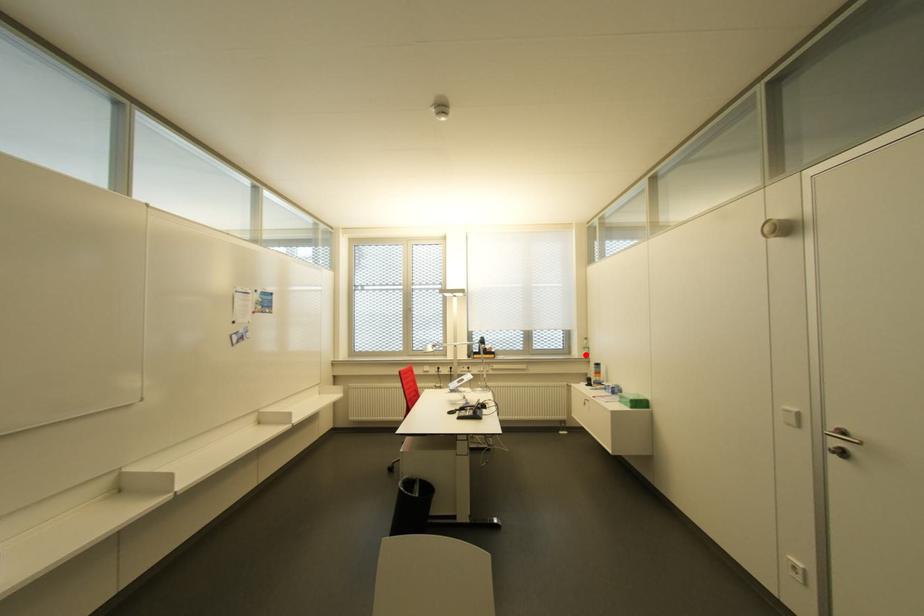
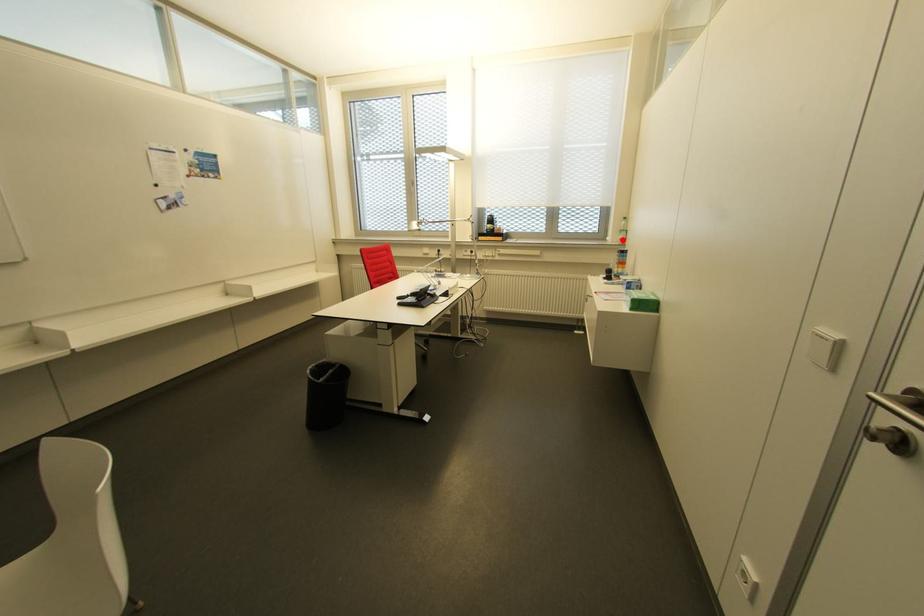
I am providing you with two images of the same scene from different viewpoints. A red point is marked on the first image and another point is marked on the second image. Does the point marked in image1 correspond to the same location as the one in image2?

Yes